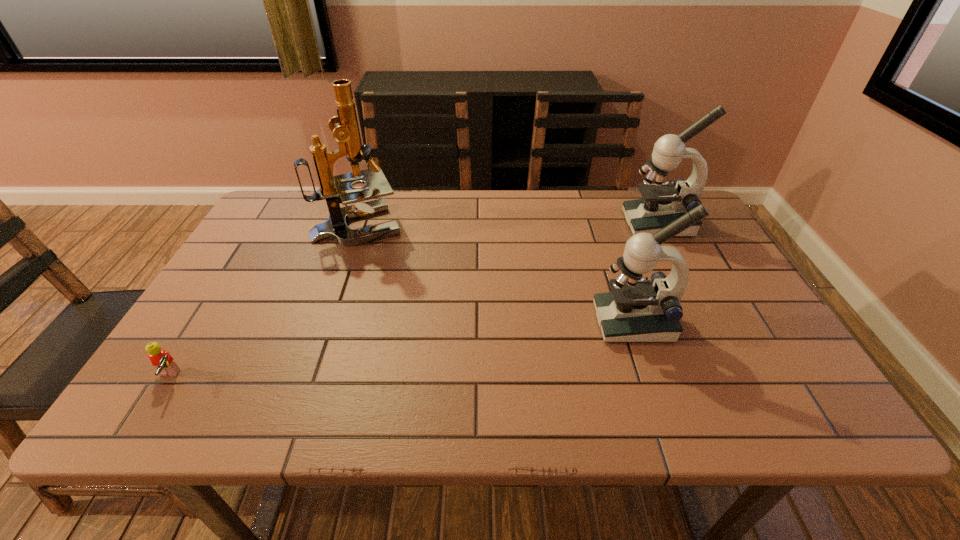
The height and width of the screenshot is (540, 960). Identify the location of the third object from right to left. (338, 189).

Where is `the nearest microscope`? the nearest microscope is located at coordinates (636, 310).

Image resolution: width=960 pixels, height=540 pixels. I want to click on the shortest object, so click(x=161, y=359).

Locate an element on the screen. This screenshot has height=540, width=960. the nearest object is located at coordinates (161, 359).

Where is `free space located 0.090m at the eyepiece of the leftmost microscope`? free space located 0.090m at the eyepiece of the leftmost microscope is located at coordinates (433, 225).

You are a GUI agent. You are given a task and a screenshot of the screen. Output one action in this format:
    pyautogui.click(x=<x>, y=<y>)
    Task: Click on the blank space located 0.130m at the eyepiece of the third farthest object
    The width and height of the screenshot is (960, 540).
    Given the screenshot: What is the action you would take?
    pyautogui.click(x=540, y=322)

What are the coordinates of `vacant region located at the eyepiece of the third farthest object` in the screenshot? It's located at (432, 322).

Image resolution: width=960 pixels, height=540 pixels. In order to click on blank space located at the eyepiece of the third farthest object in this screenshot , I will do `click(554, 322)`.

Where is `free spot located in front of the leftmost object with the accessory visible`? free spot located in front of the leftmost object with the accessory visible is located at coordinates (254, 379).

Where is `object that is at the near edge`? object that is at the near edge is located at coordinates (161, 359).